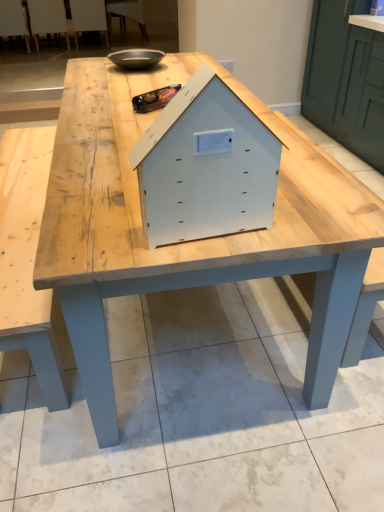
You are a GUI agent. You are given a task and a screenshot of the screen. Output one action in this format:
    pyautogui.click(x=<x>, y=<y>)
    Task: Click on the blank space to the left of white matte wooden house at center
    This screenshot has width=384, height=512.
    Given the screenshot: What is the action you would take?
    (x=109, y=229)